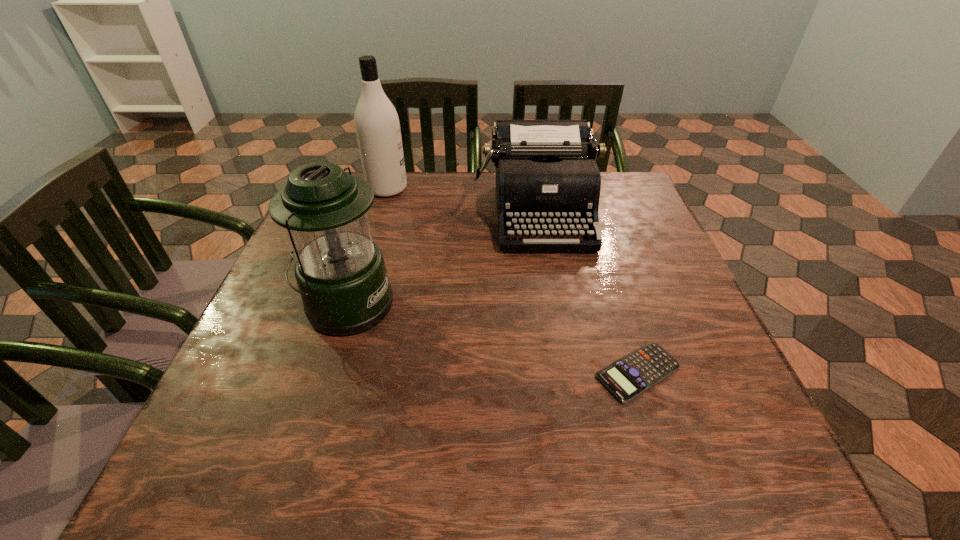
Find the location of a particular element. shampoo is located at coordinates (377, 125).

Image resolution: width=960 pixels, height=540 pixels. In order to click on the third farthest object in this screenshot , I will do `click(340, 272)`.

The image size is (960, 540). Find the location of `typewriter`. typewriter is located at coordinates (547, 178).

Identify the location of the shortest object. (628, 377).

This screenshot has height=540, width=960. In order to click on calculator in this screenshot , I will do `click(628, 377)`.

Find the location of a particular element. free space located on the front-facing side of the shampoo is located at coordinates (429, 189).

This screenshot has height=540, width=960. Identify the location of vacant area situated on the front of the second nearest object. (310, 422).

Locate an element on the screen. vacant region located 0.320m on the typing side of the typewriter is located at coordinates pos(566,373).

What are the coordinates of `free space located 0.080m on the left of the nearest object` in the screenshot? It's located at (547, 373).

At what (x,y) coordinates should I click in order to perform the action: click on shampoo positioned at the far edge. Please return your answer as a coordinate pair (x, y). This screenshot has width=960, height=540. Looking at the image, I should click on (377, 125).